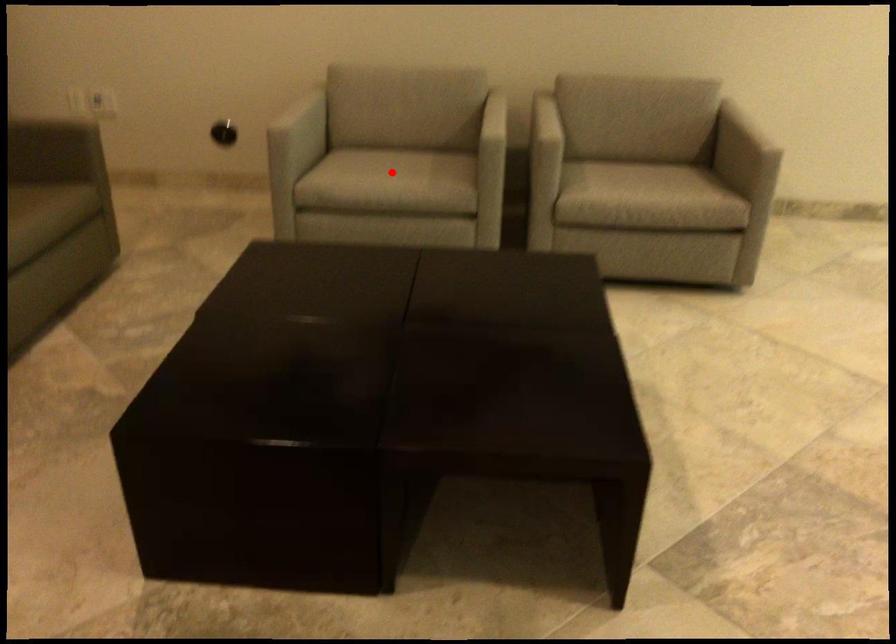
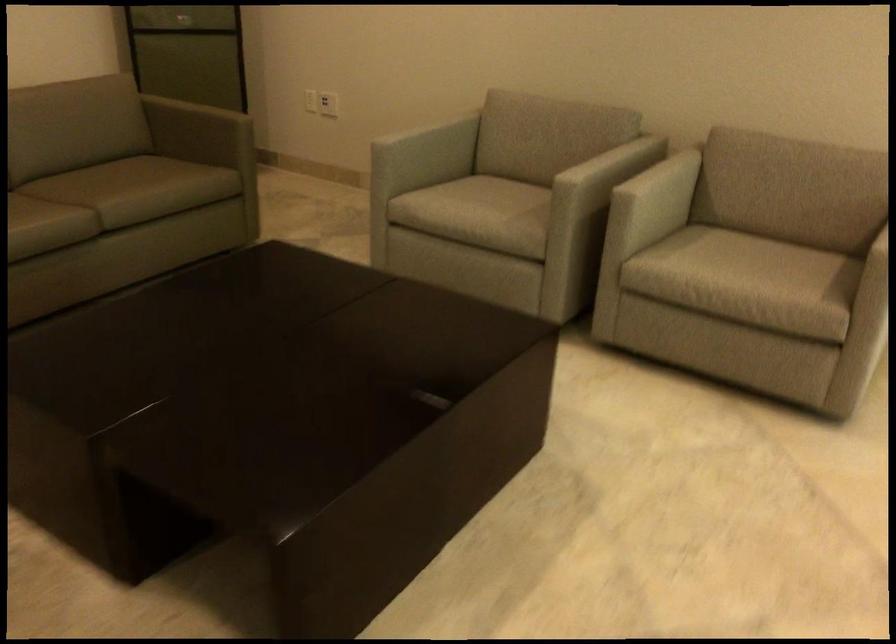
Question: I am providing you with two images of the same scene from different viewpoints. A red point is marked on the first image. At the location where the point appears in image 1, is it still visible in image 2?

Choices:
 (A) Yes
 (B) No

Answer: (A)